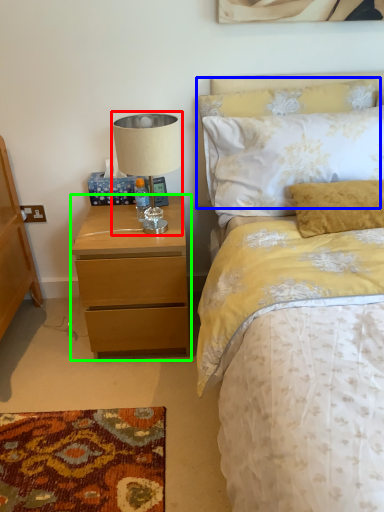
Question: Which object is the farthest from table lamp (highlighted by a red box)? Choose among these: pillow (highlighted by a blue box) or nightstand (highlighted by a green box).

Choices:
 (A) pillow
 (B) nightstand

Answer: (A)